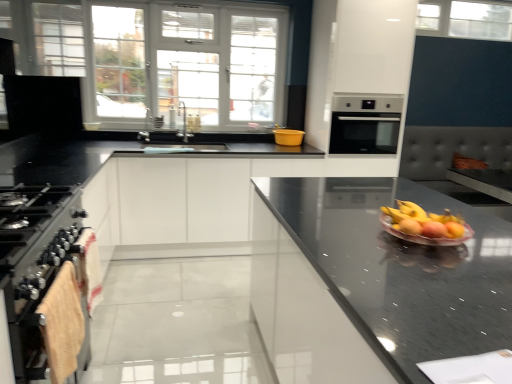
Question: Is satin silver oven at center facing towards black glossy countertop at center?

Choices:
 (A) yes
 (B) no

Answer: (A)

Question: Can you confirm if satin silver oven at center is positioned to the left of black glossy countertop at center?

Choices:
 (A) yes
 (B) no

Answer: (B)

Question: Is satin silver oven at center wider than black glossy countertop at center?

Choices:
 (A) no
 (B) yes

Answer: (A)

Question: From a real-world perspective, is satin silver oven at center under black glossy countertop at center?

Choices:
 (A) yes
 (B) no

Answer: (B)

Question: From the image's perspective, is satin silver oven at center located beneath black glossy countertop at center?

Choices:
 (A) no
 (B) yes

Answer: (A)

Question: Considering the positions of yellow plastic bowl at center and clear glass window at upper center, marked as the 1th window in a right-to-left arrangement, in the image, is yellow plastic bowl at center bigger or smaller than clear glass window at upper center, marked as the 1th window in a right-to-left arrangement,?

Choices:
 (A) small
 (B) big

Answer: (A)

Question: Visually, is yellow plastic bowl at center positioned to the left or to the right of clear glass window at upper center, the first window positioned from the top?

Choices:
 (A) left
 (B) right

Answer: (A)

Question: Is yellow plastic bowl at center wider or thinner than clear glass window at upper center, placed as the 2th window when sorted from left to right?

Choices:
 (A) wide
 (B) thin

Answer: (A)

Question: From the image's perspective, is yellow plastic bowl at center above or below clear glass window at upper center, the first window positioned from the top?

Choices:
 (A) below
 (B) above

Answer: (A)

Question: Based on their sizes in the image, would you say stainless steel oven at left is bigger or smaller than beige towel at lower left?

Choices:
 (A) big
 (B) small

Answer: (A)

Question: Does point (0, 203) appear closer or farther from the camera than point (62, 314)?

Choices:
 (A) closer
 (B) farther

Answer: (B)

Question: From their relative heights in the image, would you say stainless steel oven at left is taller or shorter than beige towel at lower left?

Choices:
 (A) short
 (B) tall

Answer: (B)

Question: From a real-world perspective, is stainless steel oven at left physically located above or below beige towel at lower left?

Choices:
 (A) above
 (B) below

Answer: (B)

Question: Based on their positions, is satin silver oven at center located to the left or right of beige towel at lower left?

Choices:
 (A) left
 (B) right

Answer: (B)

Question: Looking at their shapes, would you say satin silver oven at center is wider or thinner than beige towel at lower left?

Choices:
 (A) thin
 (B) wide

Answer: (B)